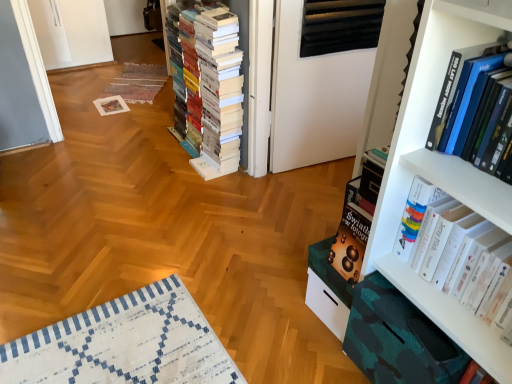
Locate an element on the screen. The height and width of the screenshot is (384, 512). vacant space that is to the left of white matte book at center, acting as the first book starting from the left is located at coordinates (126, 156).